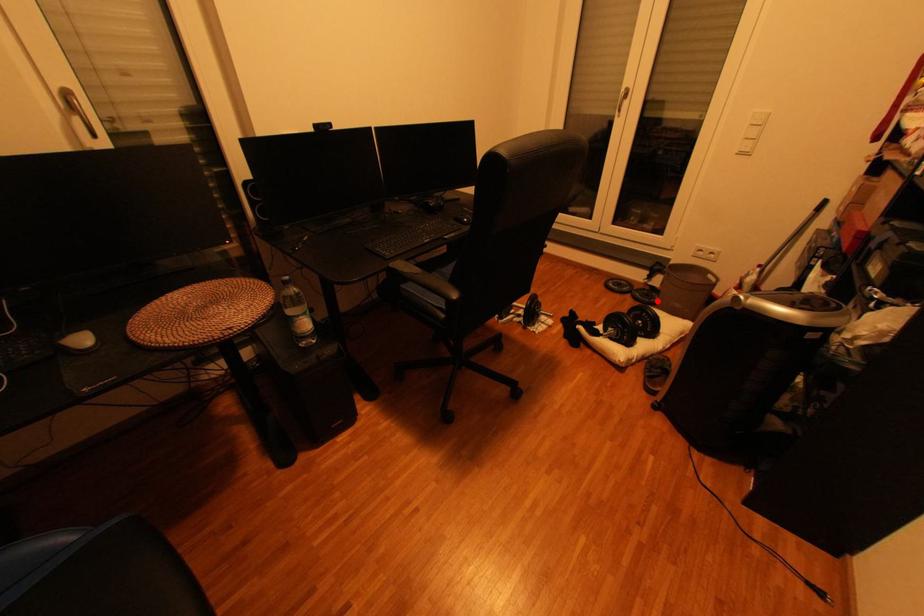
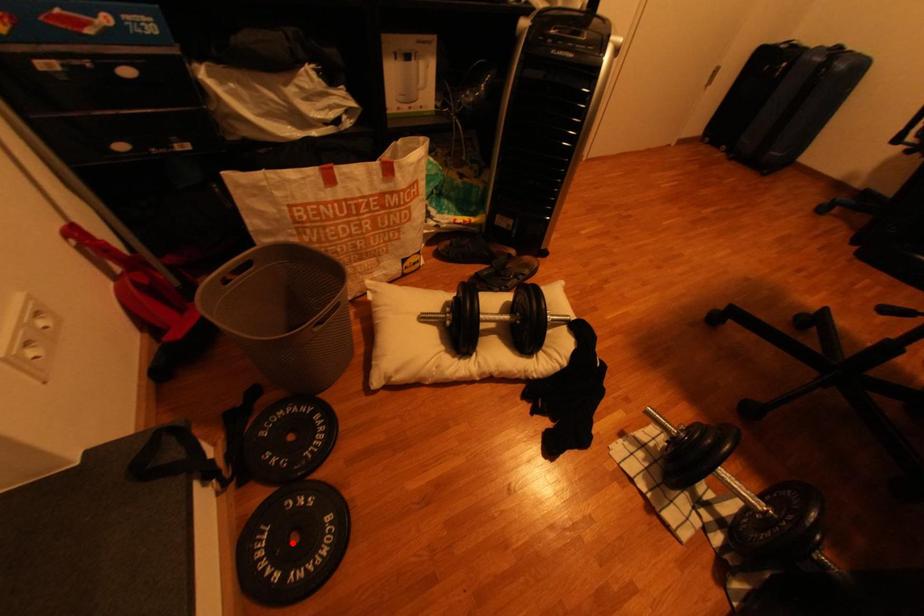
I am providing you with two images of the same scene from different viewpoints. A red point is marked on the first image and another point is marked on the second image. Do the highlighted points in image1 and image2 indicate the same real-world spot?

No